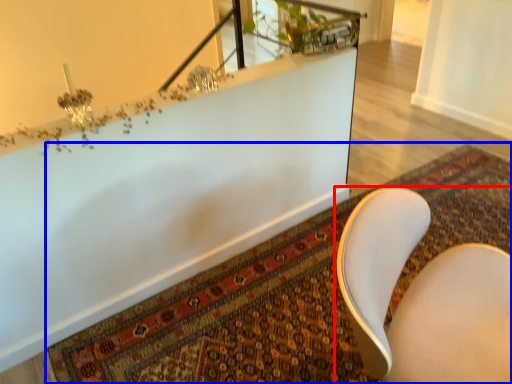
Question: Which object appears farthest to the camera in this image, chair (highlighted by a red box) or mat (highlighted by a blue box)?

Choices:
 (A) chair
 (B) mat

Answer: (B)